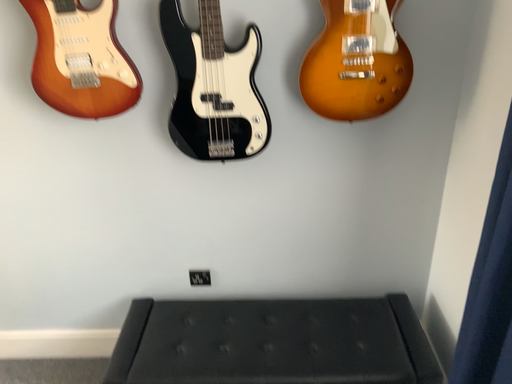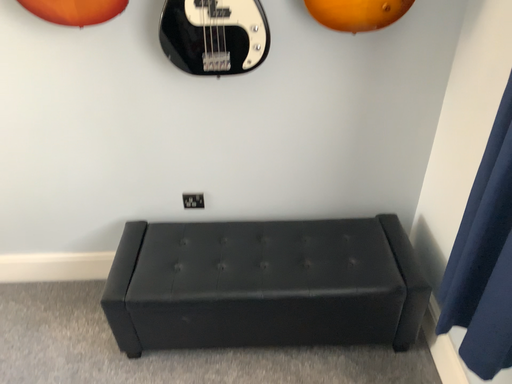
Question: Which way did the camera rotate in the video?

Choices:
 (A) rotated upward
 (B) rotated downward

Answer: (B)